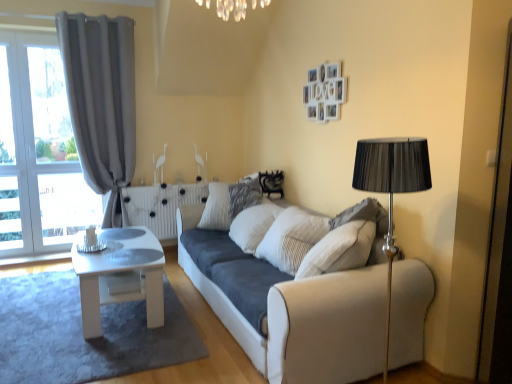
The image size is (512, 384). In order to click on white glossy table at center in this screenshot , I will do `click(120, 275)`.

What is the approximate height of white glossy table at center?

white glossy table at center is 18.54 inches tall.

Identify the location of suede-like beige pillow at right. The image size is (512, 384). (364, 215).

Which is in front, white glossy coffee table at lower left or white fabric couch at center?

Positioned in front is white fabric couch at center.

This screenshot has width=512, height=384. What are the coordinates of `plain that is below the white fabric couch at center (from the image's perspective)` in the screenshot? It's located at (82, 333).

Who is taller, white glossy coffee table at lower left or white fabric couch at center?

Standing taller between the two is white fabric couch at center.

Based on the photo, considering the sizes of objects white glossy coffee table at lower left and white fabric couch at center in the image provided, who is bigger, white glossy coffee table at lower left or white fabric couch at center?

Bigger between the two is white fabric couch at center.

Who is smaller, suede-like beige pillow at right or white glossy table at center?

suede-like beige pillow at right.

Which object is further away from the camera, suede-like beige pillow at right or white glossy table at center?

white glossy table at center.

Based on the photo, which object is wider, suede-like beige pillow at right or white glossy table at center?

With larger width is white glossy table at center.

The width and height of the screenshot is (512, 384). What are the coordinates of `studio couch in front of the white glossy coffee table at lower left` in the screenshot? It's located at coord(289,291).

Does white fabric couch at center come in front of white glossy coffee table at lower left?

Yes, white fabric couch at center is closer to the viewer.

Does white fabric couch at center have a lesser height compared to white glossy coffee table at lower left?

In fact, white fabric couch at center may be taller than white glossy coffee table at lower left.

From a real-world perspective, is white fabric couch at center physically located above or below white glossy coffee table at lower left?

white fabric couch at center is above white glossy coffee table at lower left.

Is point (117, 363) in front of point (379, 233)?

Yes, point (117, 363) is closer to viewer.

Based on the photo, based on their positions, is white glossy coffee table at lower left located to the left or right of suede-like beige pillow at right?

Clearly, white glossy coffee table at lower left is on the left of suede-like beige pillow at right in the image.

Is white glossy coffee table at lower left taller than suede-like beige pillow at right?

In fact, white glossy coffee table at lower left may be shorter than suede-like beige pillow at right.

From the picture: Are gray fabric curtain at left and white glossy coffee table at lower left located far from each other?

gray fabric curtain at left is far away from white glossy coffee table at lower left.

Is white glossy coffee table at lower left at the back of gray fabric curtain at left?

gray fabric curtain at left does not have its back to white glossy coffee table at lower left.

Considering the sizes of objects gray fabric curtain at left and white glossy coffee table at lower left in the image provided, who is wider, gray fabric curtain at left or white glossy coffee table at lower left?

With larger width is white glossy coffee table at lower left.

From the picture: Considering the sizes of white glossy coffee table at lower left and white glossy table at center in the image, is white glossy coffee table at lower left wider or thinner than white glossy table at center?

Considering their sizes, white glossy coffee table at lower left looks broader than white glossy table at center.

In the scene shown: From the image's perspective, relative to white glossy table at center, is white glossy coffee table at lower left above or below?

white glossy coffee table at lower left is situated lower than white glossy table at center in the image.

Is point (103, 356) behind point (152, 287)?

That is False.

From a real-world perspective, is white fabric couch at center under white glossy table at center?

Actually, white fabric couch at center is physically above white glossy table at center in the real world.

Is white fabric couch at center located outside white glossy table at center?

Indeed, white fabric couch at center is completely outside white glossy table at center.

Is white fabric couch at center looking in the opposite direction of white glossy table at center?

That's not correct — white fabric couch at center is not looking away from white glossy table at center.

Is white fabric couch at center thinner than white glossy table at center?

Incorrect, the width of white fabric couch at center is not less than that of white glossy table at center.

Where is `studio couch that is above the white glossy coffee table at lower left (from a real-world perspective)`? The height and width of the screenshot is (384, 512). studio couch that is above the white glossy coffee table at lower left (from a real-world perspective) is located at coordinates (289, 291).

At what (x,y) coordinates should I click in order to perform the action: click on pillow in front of the white glossy table at center. Please return your answer as a coordinate pair (x, y). The width and height of the screenshot is (512, 384). Looking at the image, I should click on (364, 215).

When comparing their distances from suede-like beige pillow at right, does white glossy coffee table at lower left or white glossy table at center seem closer?

The object closer to suede-like beige pillow at right is white glossy table at center.

Which object lies further to the anchor point white glossy coffee table at lower left, white fabric couch at center or gray fabric curtain at left?

Among the two, gray fabric curtain at left is located further to white glossy coffee table at lower left.

Looking at the image, which one is located further to gray fabric curtain at left, white fabric couch at center or suede-like beige pillow at right?

suede-like beige pillow at right.

Which object lies nearer to the anchor point white glossy table at center, white glossy coffee table at lower left or white fabric couch at center?

white glossy coffee table at lower left lies closer to white glossy table at center than the other object.

From the image, which object appears to be farther from gray fabric curtain at left, white fabric couch at center or white glossy table at center?

Among the two, white fabric couch at center is located further to gray fabric curtain at left.

Which object lies nearer to the anchor point white glossy table at center, white glossy coffee table at lower left or suede-like beige pillow at right?

white glossy coffee table at lower left is positioned closer to the anchor white glossy table at center.

Looking at the image, which one is located closer to gray fabric curtain at left, suede-like beige pillow at right or white glossy coffee table at lower left?

white glossy coffee table at lower left lies closer to gray fabric curtain at left than the other object.

Looking at the image, which one is located further to white glossy table at center, gray fabric curtain at left or white glossy coffee table at lower left?

gray fabric curtain at left is positioned further to the anchor white glossy table at center.

Where is `table located between white fabric couch at center and gray fabric curtain at left in the depth direction`? The width and height of the screenshot is (512, 384). table located between white fabric couch at center and gray fabric curtain at left in the depth direction is located at coordinates (120, 275).

I want to click on studio couch between white glossy table at center and suede-like beige pillow at right from left to right, so click(x=289, y=291).

You are a GUI agent. You are given a task and a screenshot of the screen. Output one action in this format:
    pyautogui.click(x=<x>, y=<y>)
    Task: Click on the table between white glossy coffee table at lower left and gray fabric curtain at left along the z-axis
    
    Given the screenshot: What is the action you would take?
    pyautogui.click(x=120, y=275)

The image size is (512, 384). I want to click on plain between white fabric couch at center and gray fabric curtain at left in the front-back direction, so [82, 333].